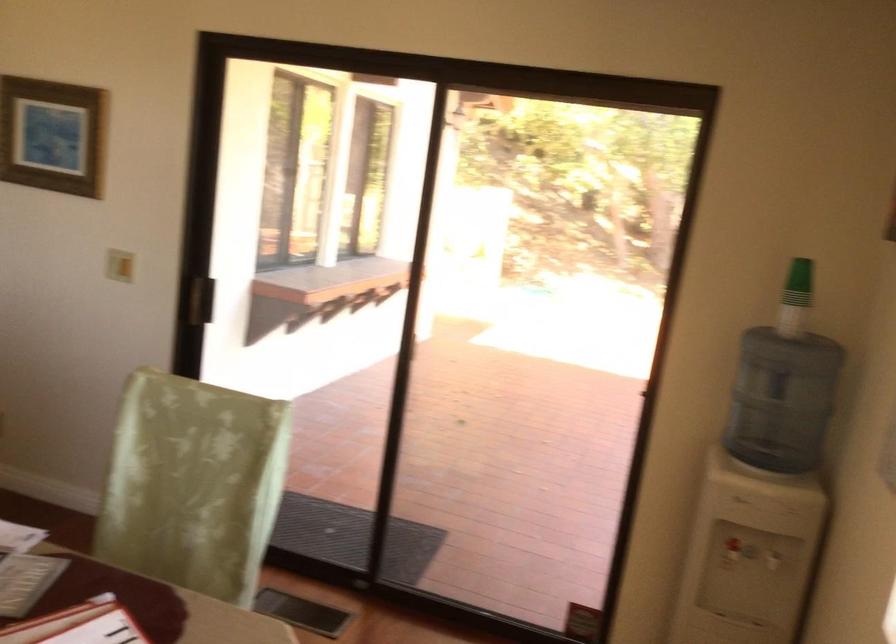
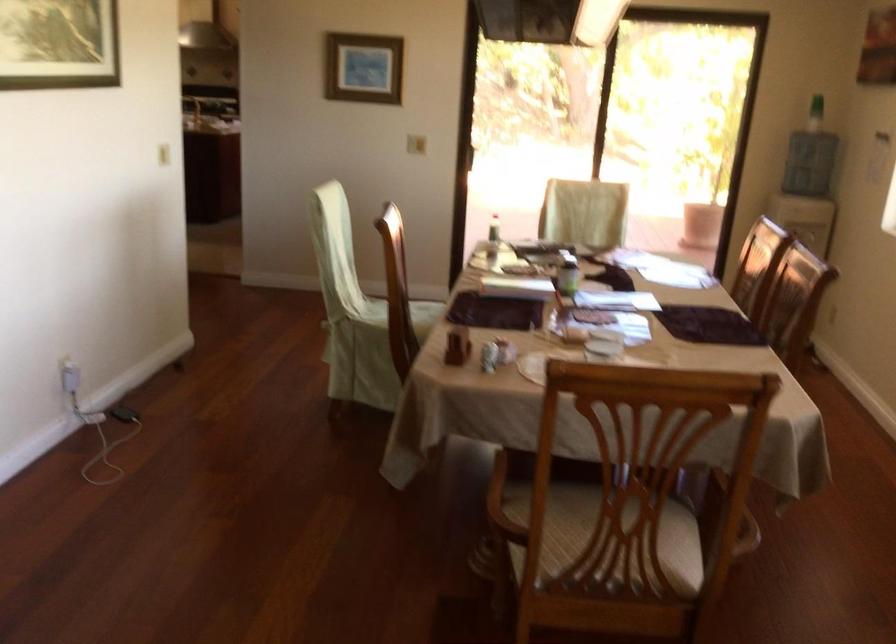
Question: I am providing you with two images of the same scene from different viewpoints. After the viewpoint changes to image2, which objects are now occluded?

Choices:
 (A) red fire alarm
 (B) white power adapter
 (C) light green chair sitting surface
 (D) green label jar

Answer: (C)